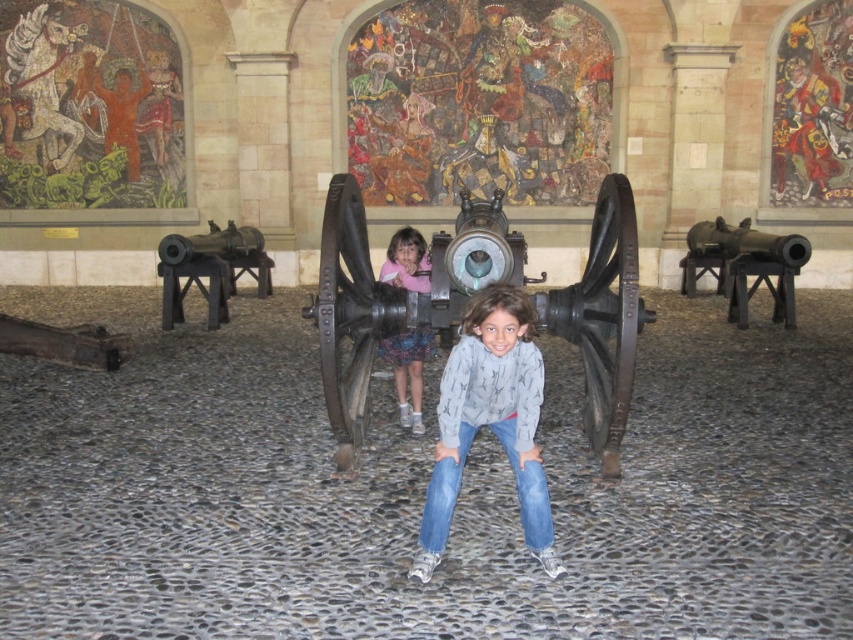
Who is higher up, gray cotton hoodie at center or pink fabric dress at center?

gray cotton hoodie at center

Who is more forward, (508, 394) or (397, 285)?

Point (508, 394)

Find the location of `gray cotton hoodie at center`. gray cotton hoodie at center is located at coordinates (489, 420).

Who is positioned more to the left, gray cotton hoodie at center or blue denim jeans at center?

blue denim jeans at center is more to the left.

Between gray cotton hoodie at center and blue denim jeans at center, which one appears on the right side from the viewer's perspective?

gray cotton hoodie at center

Identify the location of gray cotton hoodie at center. (489, 420).

Is point (447, 250) in front of point (705, 257)?

Yes, point (447, 250) is closer to viewer.

Who is higher up, polished bronze cannon at center or polished bronze cannon at right?

polished bronze cannon at right

Image resolution: width=853 pixels, height=640 pixels. I want to click on polished bronze cannon at center, so click(395, 296).